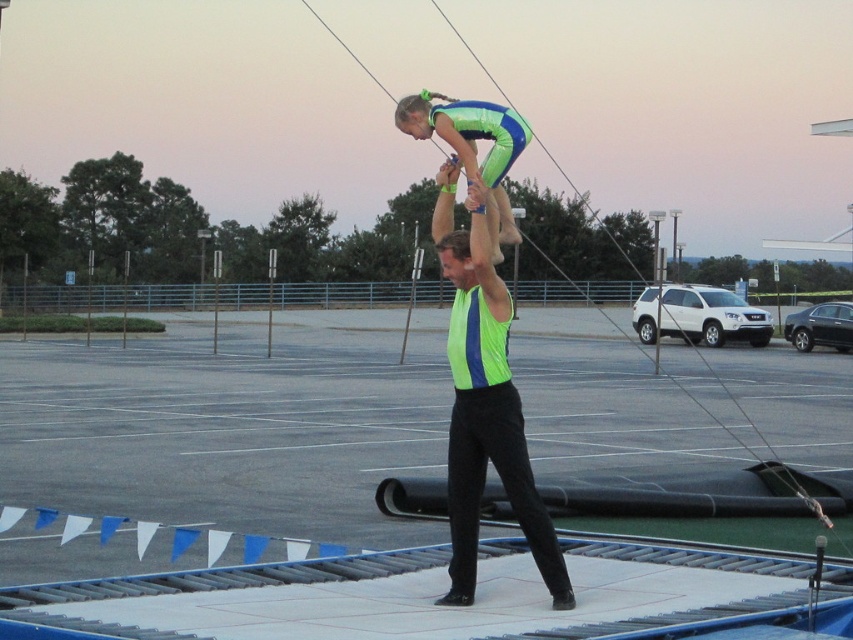
Is neon green fabric at center smaller than green matte gymnast at upper center?

Yes.

Does neon green fabric at center have a greater width compared to green matte gymnast at upper center?

In fact, neon green fabric at center might be narrower than green matte gymnast at upper center.

Locate an element on the screen. The image size is (853, 640). neon green fabric at center is located at coordinates (489, 435).

At what (x,y) coordinates should I click in order to perform the action: click on neon green fabric at center. Please return your answer as a coordinate pair (x, y). The width and height of the screenshot is (853, 640). Looking at the image, I should click on (489, 435).

Is point (497, 452) positioned behind point (485, 332)?

No, (497, 452) is in front of (485, 332).

You are a GUI agent. You are given a task and a screenshot of the screen. Output one action in this format:
    pyautogui.click(x=<x>, y=<y>)
    Task: Click on the neon green fabric at center
    This screenshot has width=853, height=640.
    Given the screenshot: What is the action you would take?
    [489, 435]

Who is positioned more to the right, neon green fabric safety vest at center or green fabric head at upper center?

neon green fabric safety vest at center is more to the right.

Between point (482, 307) and point (408, 99), which one is positioned in front?

Point (482, 307) is in front.

Locate an element on the screen. neon green fabric safety vest at center is located at coordinates (477, 340).